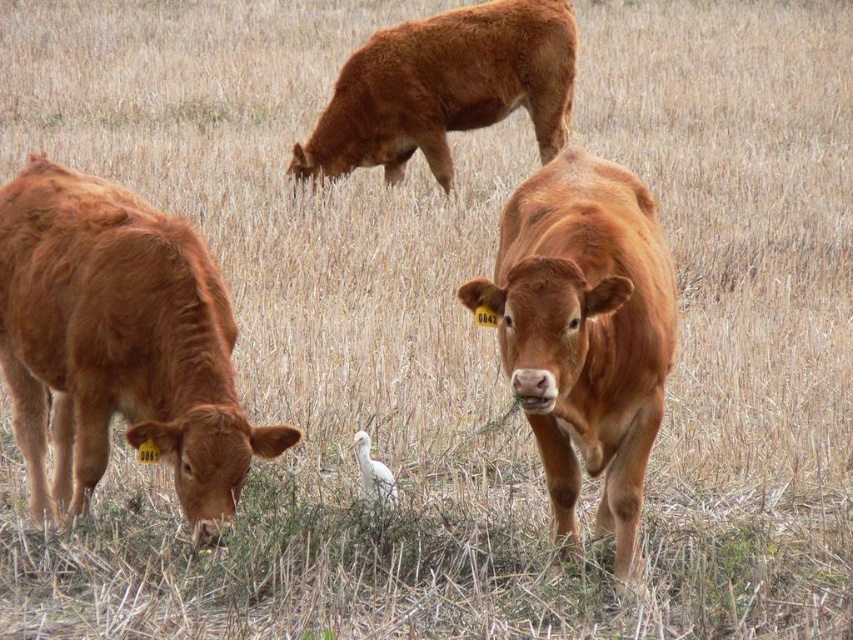
You are a farmer checking the herd. You notice the shiny brown cow at left and the brown textured cow at upper center. Which cow is smaller in size?

The shiny brown cow at left is smaller in size compared to the brown textured cow at upper center.

You are a photographer trying to capture a photo of the brown textured cow at upper center and the white matte bird at center. Based on their positions, which animal should you focus on first if you want to include both in the frame without moving your camera?

The brown textured cow at upper center is positioned on the right side of the white matte bird at center. Since the cow is to the right of the bird, you should focus on the white matte bird at center first to ensure both are in the frame without moving the camera.

You are a photographer trying to capture a clear shot of the shiny brown cow at left and the brown textured cow at upper center. Since you want both cows in focus, which cow should you focus on first to ensure the other is also in the frame?

The shiny brown cow at left is in front of the brown textured cow at upper center, so you should focus on the shiny brown cow at left first to ensure both are in focus.